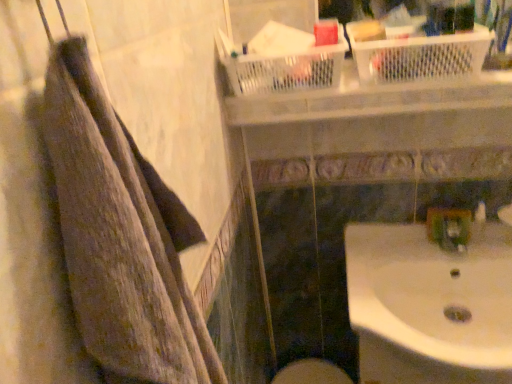
Image resolution: width=512 pixels, height=384 pixels. What do you see at coordinates (449, 228) in the screenshot?
I see `green plastic faucet at lower right` at bounding box center [449, 228].

The height and width of the screenshot is (384, 512). Find the location of `brown textured towel at left`. brown textured towel at left is located at coordinates tap(121, 237).

Is brown textured towel at left bigger or smaller than white glossy sink at lower right?

In the image, brown textured towel at left appears to be smaller than white glossy sink at lower right.

Is brown textured towel at left closer to camera compared to white glossy sink at lower right?

Yes, brown textured towel at left is in front of white glossy sink at lower right.

Who is shorter, brown textured towel at left or white glossy sink at lower right?

With less height is white glossy sink at lower right.

From the image's perspective, between white glossy sink at lower right and brown textured towel at left, which one is located above?

brown textured towel at left is shown above in the image.

This screenshot has width=512, height=384. I want to click on sink located underneath the brown textured towel at left (from a real-world perspective), so click(431, 305).

Considering the relative sizes of white glossy sink at lower right and brown textured towel at left in the image provided, is white glossy sink at lower right thinner than brown textured towel at left?

No, white glossy sink at lower right is not thinner than brown textured towel at left.

Does white glossy sink at lower right turn towards brown textured towel at left?

No, white glossy sink at lower right is not oriented towards brown textured towel at left.

Is point (468, 229) closer or farther from the camera than point (141, 174)?

Point (468, 229) appears to be farther away from the viewer than point (141, 174).

Does green plastic faucet at lower right have a smaller size compared to brown textured towel at left?

Yes, green plastic faucet at lower right is smaller than brown textured towel at left.

Between green plastic faucet at lower right and brown textured towel at left, which one appears on the right side from the viewer's perspective?

green plastic faucet at lower right is more to the right.

Looking at this image, from the image's perspective, which one is positioned higher, green plastic faucet at lower right or brown textured towel at left?

From the image's view, brown textured towel at left is above.

From a real-world perspective, between white glossy sink at lower right and green plastic faucet at lower right, who is vertically higher?

green plastic faucet at lower right, from a real-world perspective.

Looking at this image, can you tell me how much white glossy sink at lower right and green plastic faucet at lower right differ in facing direction?

The angular difference between white glossy sink at lower right and green plastic faucet at lower right is 0.568 degrees.

Considering the positions of objects white glossy sink at lower right and green plastic faucet at lower right in the image provided, who is more to the right, white glossy sink at lower right or green plastic faucet at lower right?

green plastic faucet at lower right is more to the right.

Considering the sizes of objects white glossy sink at lower right and green plastic faucet at lower right in the image provided, who is taller, white glossy sink at lower right or green plastic faucet at lower right?

white glossy sink at lower right.

Is green plastic faucet at lower right facing away from white glossy sink at lower right?

No, white glossy sink at lower right is not at the back of green plastic faucet at lower right.

Between green plastic faucet at lower right and white glossy sink at lower right, which one has larger size?

white glossy sink at lower right.

Between green plastic faucet at lower right and white glossy sink at lower right, which one appears on the left side from the viewer's perspective?

Positioned to the left is white glossy sink at lower right.

Which of these two, green plastic faucet at lower right or white glossy sink at lower right, stands shorter?

green plastic faucet at lower right.

Can you confirm if brown textured towel at left is wider than green plastic faucet at lower right?

Yes.

Is green plastic faucet at lower right a part of brown textured towel at left?

No, green plastic faucet at lower right is not inside brown textured towel at left.

Could you tell me if brown textured towel at left is turned towards green plastic faucet at lower right?

No, brown textured towel at left is not facing towards green plastic faucet at lower right.

From a real-world perspective, between brown textured towel at left and green plastic faucet at lower right, who is vertically higher?

brown textured towel at left, from a real-world perspective.

Locate an element on the screen. sink to the right of brown textured towel at left is located at coordinates (431, 305).

Locate an element on the screen. This screenshot has height=384, width=512. sink below the brown textured towel at left (from the image's perspective) is located at coordinates (431, 305).

Estimate the real-world distances between objects in this image. Which object is further from brown textured towel at left, white glossy sink at lower right or green plastic faucet at lower right?

green plastic faucet at lower right is positioned further to the anchor brown textured towel at left.

When comparing their distances from green plastic faucet at lower right, does white glossy sink at lower right or brown textured towel at left seem closer?

white glossy sink at lower right.

Considering their positions, is green plastic faucet at lower right positioned closer to brown textured towel at left than white glossy sink at lower right?

white glossy sink at lower right lies closer to brown textured towel at left than the other object.

Based on their spatial positions, is brown textured towel at left or green plastic faucet at lower right closer to white glossy sink at lower right?

green plastic faucet at lower right.

Consider the image. Based on their spatial positions, is brown textured towel at left or white glossy sink at lower right further from green plastic faucet at lower right?

brown textured towel at left is positioned further to the anchor green plastic faucet at lower right.

From the picture: Looking at the image, which one is located further to white glossy sink at lower right, green plastic faucet at lower right or brown textured towel at left?

brown textured towel at left is further to white glossy sink at lower right.

Locate an element on the screen. sink located between brown textured towel at left and green plastic faucet at lower right in the depth direction is located at coordinates (431, 305).